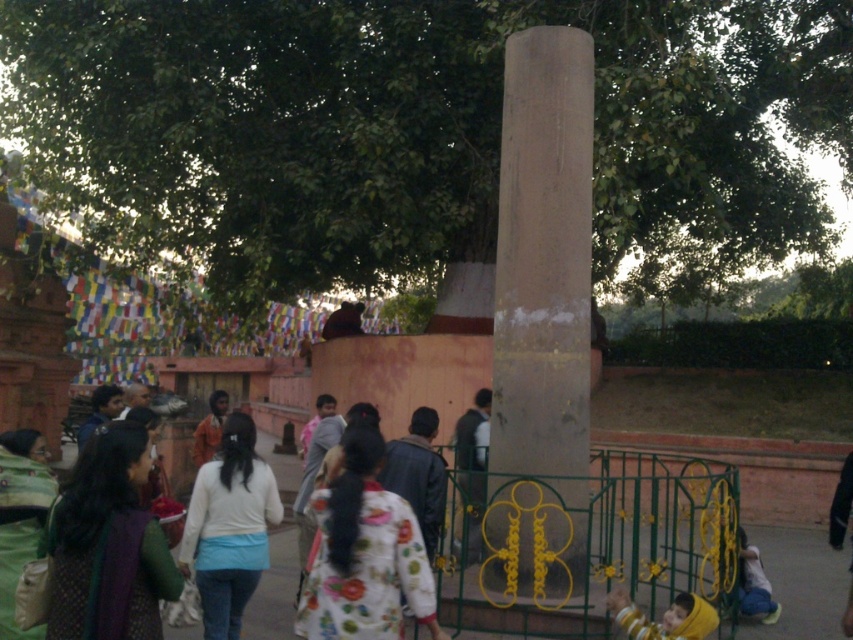
Can you confirm if green textured dress at center is bigger than white matte shirt at center?

Actually, green textured dress at center might be smaller than white matte shirt at center.

Which is in front, point (76, 595) or point (258, 529)?

Positioned in front is point (76, 595).

Locate an element on the screen. The image size is (853, 640). green textured dress at center is located at coordinates (108, 545).

Is the position of smooth stone pillar at center more distant than that of white matte shirt at center?

Yes.

The height and width of the screenshot is (640, 853). What do you see at coordinates (541, 320) in the screenshot?
I see `smooth stone pillar at center` at bounding box center [541, 320].

The image size is (853, 640). Identify the location of smooth stone pillar at center. (541, 320).

I want to click on white matte shirt at center, so click(x=229, y=528).

Is point (212, 611) less distant than point (219, 422)?

Yes, point (212, 611) is in front of point (219, 422).

Locate an element on the screen. The width and height of the screenshot is (853, 640). white matte shirt at center is located at coordinates (229, 528).